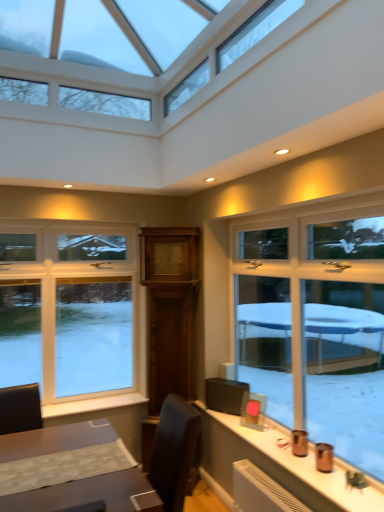
Question: From the image's perspective, is white painted wood at lower left positioned above or below white plastic window at left?

Choices:
 (A) below
 (B) above

Answer: (A)

Question: Would you say white painted wood at lower left is to the left or to the right of white plastic window at left in the picture?

Choices:
 (A) right
 (B) left

Answer: (A)

Question: Is white painted wood at lower left in front of or behind white plastic window at left in the image?

Choices:
 (A) behind
 (B) front

Answer: (B)

Question: Is point (102, 366) positioned closer to the camera than point (96, 404)?

Choices:
 (A) farther
 (B) closer

Answer: (A)

Question: From a real-world perspective, is white plastic window at left physically located above or below white painted wood at lower left?

Choices:
 (A) above
 (B) below

Answer: (A)

Question: In terms of width, does white plastic window at left look wider or thinner when compared to white painted wood at lower left?

Choices:
 (A) thin
 (B) wide

Answer: (A)

Question: Is white plastic window at left taller or shorter than white painted wood at lower left?

Choices:
 (A) short
 (B) tall

Answer: (B)